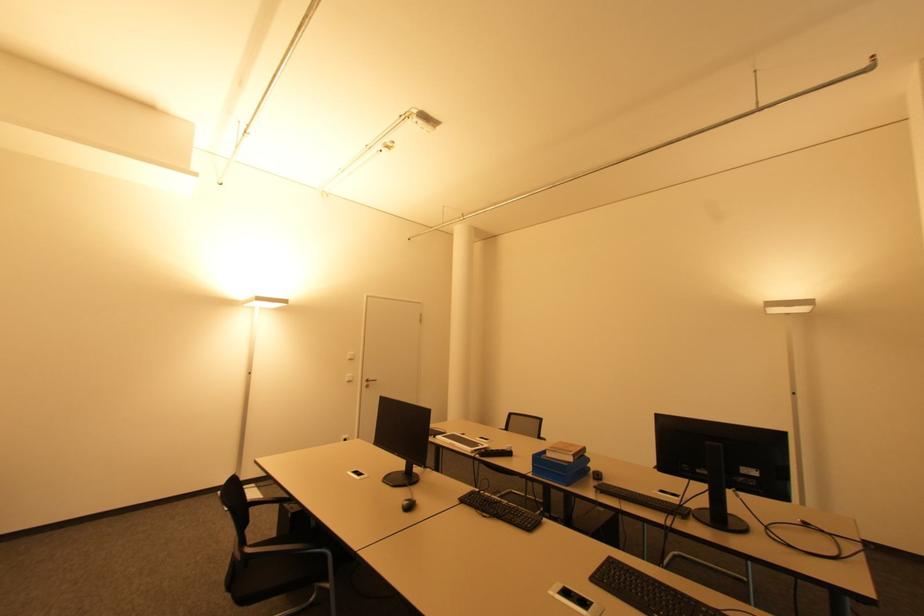
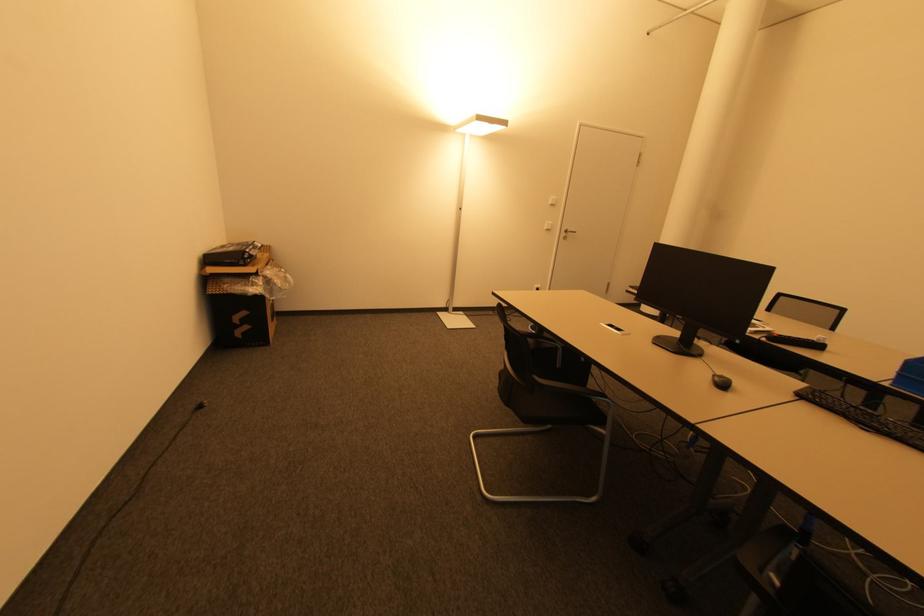
Locate, in the second image, the point that corresponds to the point at 511,454 in the first image.

(819, 346)